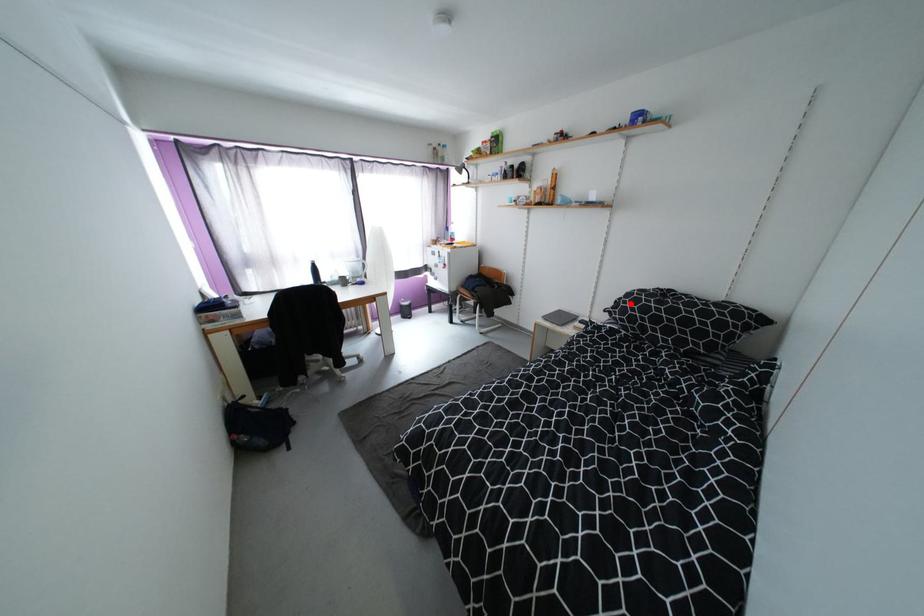
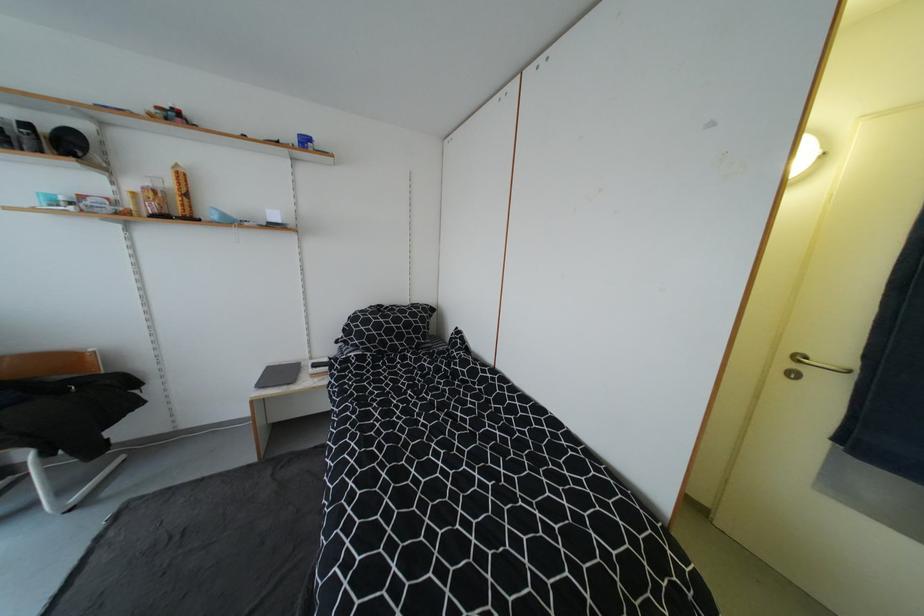
Question: A red point is marked in image1. In image2, is the corresponding 3D point closer to the camera or farther? Reply with the corresponding letter.

Choices:
 (A) The corresponding 3D point is closer.
 (B) The corresponding 3D point is farther.

Answer: (B)